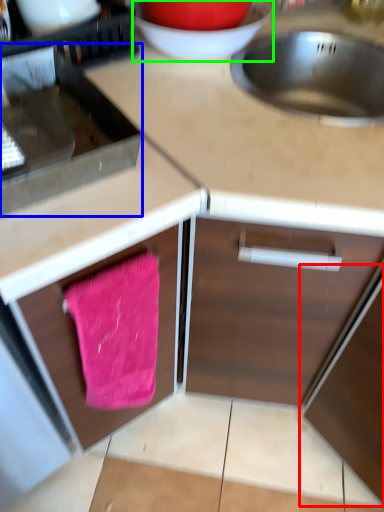
Question: Considering the real-world distances, which object is closest to appliance (highlighted by a red box)? appliance (highlighted by a blue box) or basin (highlighted by a green box).

Choices:
 (A) appliance
 (B) basin

Answer: (A)